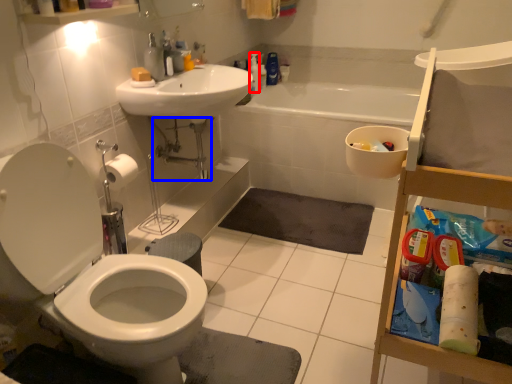
Question: Which of the following is the closest to the observer, cleaning product (highlighted by a red box) or plumbing fixture (highlighted by a blue box)?

Choices:
 (A) cleaning product
 (B) plumbing fixture

Answer: (B)